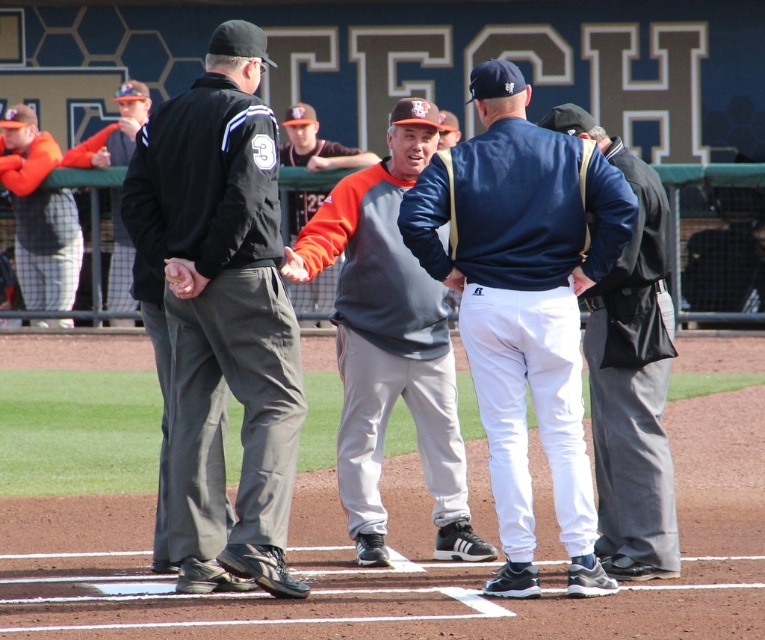
Question: Does black fabric jacket at left have a greater width compared to orange jersey at left?

Choices:
 (A) no
 (B) yes

Answer: (B)

Question: Which point is farther to the camera?

Choices:
 (A) (125, 280)
 (B) (142, 145)
 (C) (18, 131)

Answer: (C)

Question: Can you confirm if dark blue jacket at center is smaller than orange jersey at left?

Choices:
 (A) yes
 (B) no

Answer: (B)

Question: Among these points, which one is nearest to the camera?

Choices:
 (A) (659, 508)
 (B) (301, 300)

Answer: (A)

Question: Is black fabric jacket at left to the left of orange fabric jacket at center from the viewer's perspective?

Choices:
 (A) yes
 (B) no

Answer: (B)

Question: Which of the following is the closest to the observer?

Choices:
 (A) (311, 294)
 (B) (215, 42)

Answer: (B)